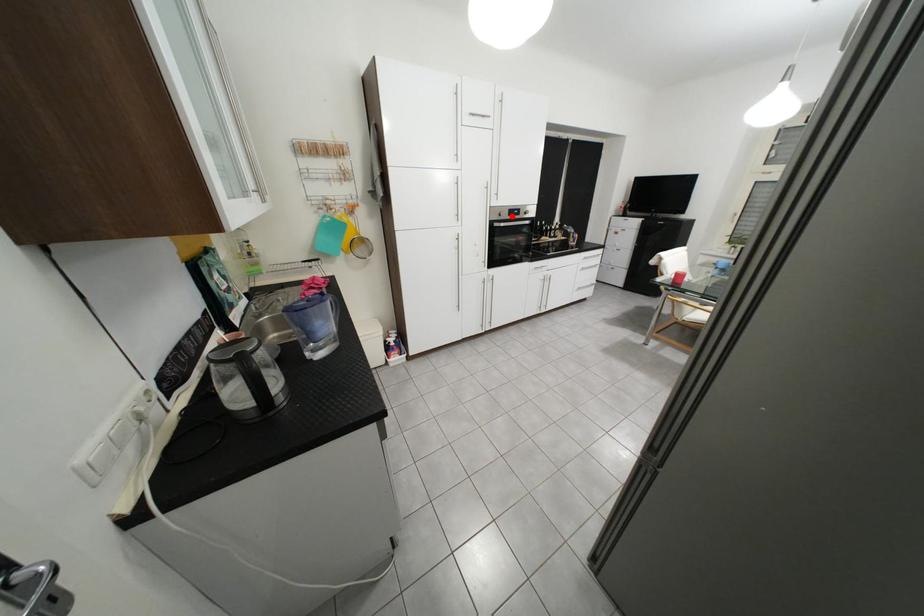
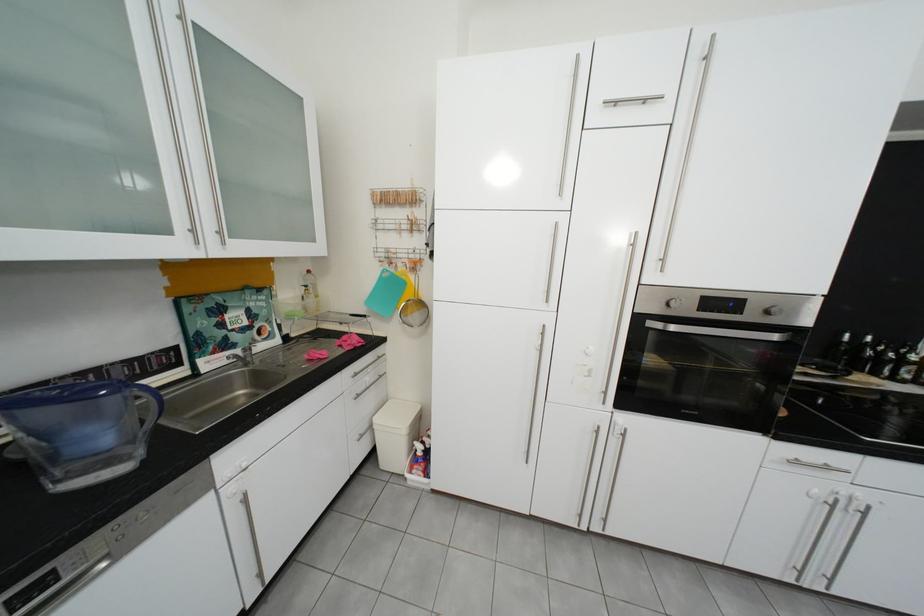
In the second image, find the point that corresponds to the highlighted location in the first image.

(679, 306)